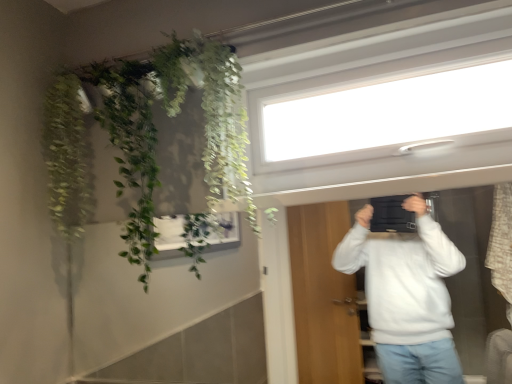
Question: Considering the relative positions of green leafy plant at upper left, acting as the second plant starting from the right, and transparent glass window at upper center in the image provided, is green leafy plant at upper left, acting as the second plant starting from the right, to the left or to the right of transparent glass window at upper center?

Choices:
 (A) right
 (B) left

Answer: (B)

Question: Is green leafy plant at upper left, which appears as the first plant when viewed from the left, situated inside transparent glass window at upper center or outside?

Choices:
 (A) outside
 (B) inside

Answer: (A)

Question: Estimate the real-world distances between objects in this image. Which object is closer to the transparent glass window at upper center?

Choices:
 (A) green leafy plant at upper left, acting as the second plant starting from the right
 (B) green leafy plant at upper left, the first plant viewed from the right

Answer: (B)

Question: Which of these objects is positioned closest to the transparent glass window at upper center?

Choices:
 (A) green leafy plant at upper left, which appears as the first plant when viewed from the left
 (B) green leafy plant at upper left, the first plant viewed from the right

Answer: (B)